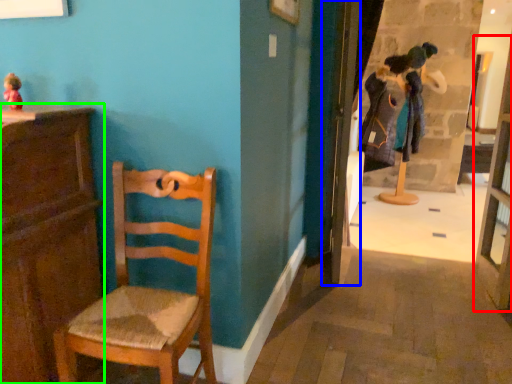
Question: Which object is the closest to the glass door (highlighted by a red box)? Choose among these: door (highlighted by a blue box) or cabinetry (highlighted by a green box).

Choices:
 (A) door
 (B) cabinetry

Answer: (A)